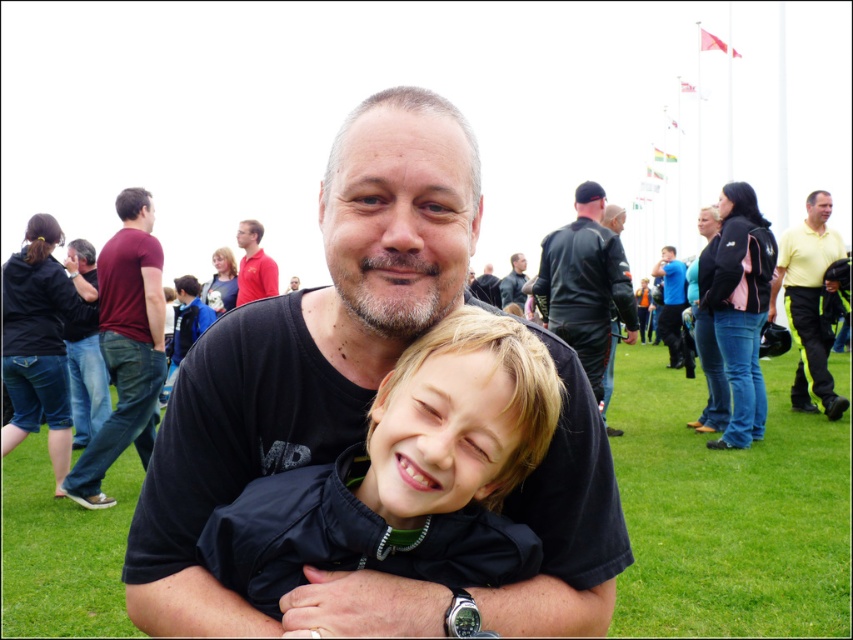
Consider the image. Does blue fabric shirt at center appear on the right side of black matte jacket at center?

Correct, you'll find blue fabric shirt at center to the right of black matte jacket at center.

Does blue fabric shirt at center come behind black matte jacket at center?

That is True.

At what (x,y) coordinates should I click in order to perform the action: click on blue fabric shirt at center. Please return your answer as a coordinate pair (x, y). Looking at the image, I should click on (671, 304).

The height and width of the screenshot is (640, 853). In order to click on blue fabric shirt at center in this screenshot , I will do `click(671, 304)`.

Does matte red shirt at upper left have a lesser width compared to black leather jacket at right?

Incorrect, matte red shirt at upper left's width is not less than black leather jacket at right's.

Is point (250, 291) positioned behind point (604, 369)?

Yes, it is behind point (604, 369).

Who is more distant from viewer, (257, 225) or (612, 380)?

The point (257, 225) is more distant.

At what (x,y) coordinates should I click in order to perform the action: click on matte red shirt at upper left. Please return your answer as a coordinate pair (x, y). Looking at the image, I should click on (254, 266).

Locate an element on the screen. The height and width of the screenshot is (640, 853). maroon fabric shirt at left is located at coordinates (126, 346).

Is point (103, 344) less distant than point (584, 269)?

Yes, it is.

Is point (67, 486) positioned before point (550, 305)?

Yes, point (67, 486) is in front of point (550, 305).

Identify the location of maroon fabric shirt at left. The height and width of the screenshot is (640, 853). (126, 346).